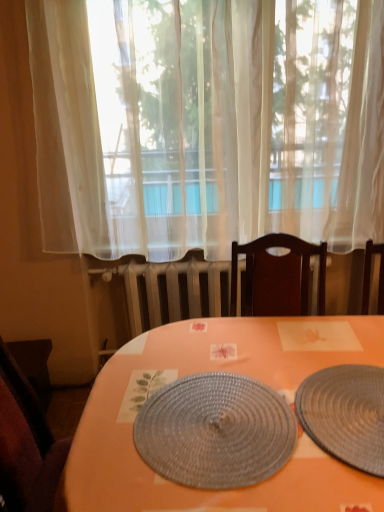
Find the location of a particular element. Image resolution: width=384 pixels, height=512 pixels. unoccupied space behind woven gray placemat at center, which is the 2th plate in right-to-left order is located at coordinates (223, 345).